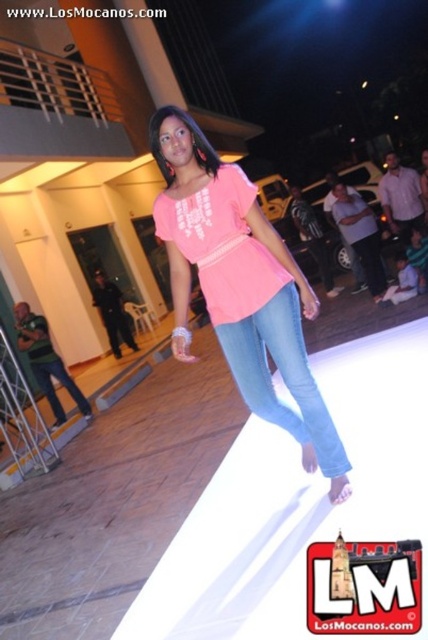
Question: Which of the following is the closest to the observer?

Choices:
 (A) pink matte t-shirt at center
 (B) jeans at center

Answer: (A)

Question: Among these points, which one is nearest to the camera?

Choices:
 (A) (293, 288)
 (B) (219, 336)

Answer: (A)

Question: Does pink matte t-shirt at center have a smaller size compared to jeans at center?

Choices:
 (A) no
 (B) yes

Answer: (A)

Question: Which point appears farthest from the camera in this image?

Choices:
 (A) (243, 349)
 (B) (287, 321)

Answer: (A)

Question: Can you confirm if pink matte t-shirt at center is wider than jeans at center?

Choices:
 (A) yes
 (B) no

Answer: (A)

Question: Does pink matte t-shirt at center appear on the left side of jeans at center?

Choices:
 (A) yes
 (B) no

Answer: (A)